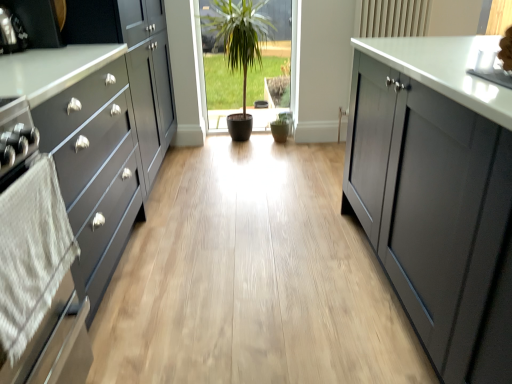
Question: From the image's perspective, is white textured towel at left above or below matte black oven at left?

Choices:
 (A) below
 (B) above

Answer: (A)

Question: Is white textured towel at left situated inside matte black oven at left or outside?

Choices:
 (A) inside
 (B) outside

Answer: (B)

Question: Which object is the closest to the green matte potted plant at center?

Choices:
 (A) white textured towel at left
 (B) matte black oven at left
 (C) matte black cabinet at left

Answer: (C)

Question: Which is nearer to the matte black cabinet at left?

Choices:
 (A) matte black oven at left
 (B) green matte potted plant at center
 (C) white textured towel at left

Answer: (C)